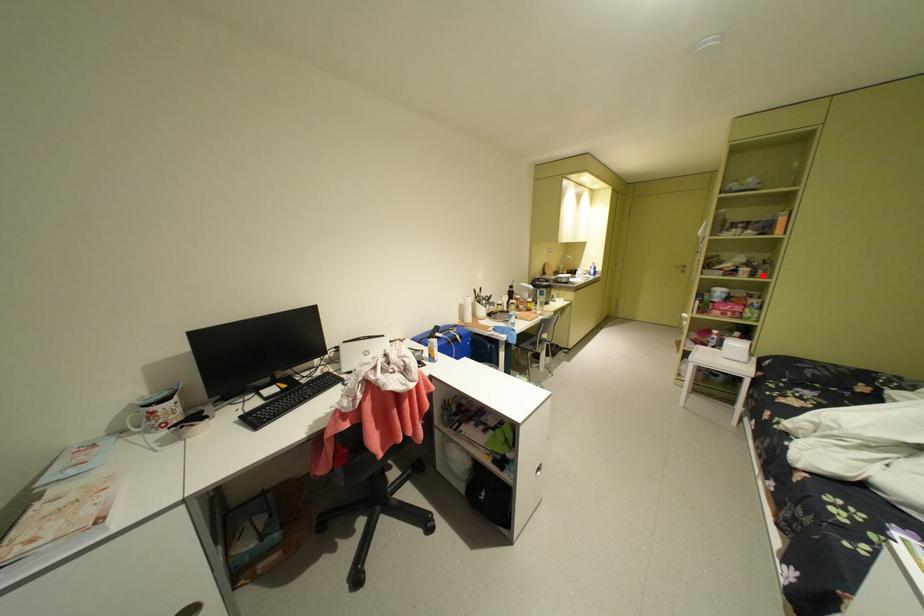
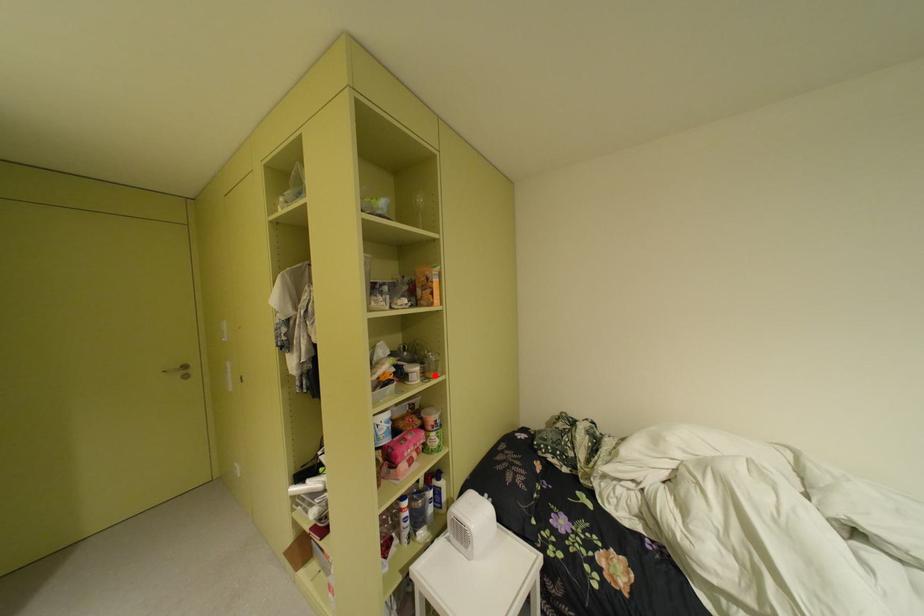
I am providing you with two images of the same scene from different viewpoints. A red point is marked on the first image and another point is marked on the second image. Is the marked point in image1 the same physical position as the marked point in image2?

Yes